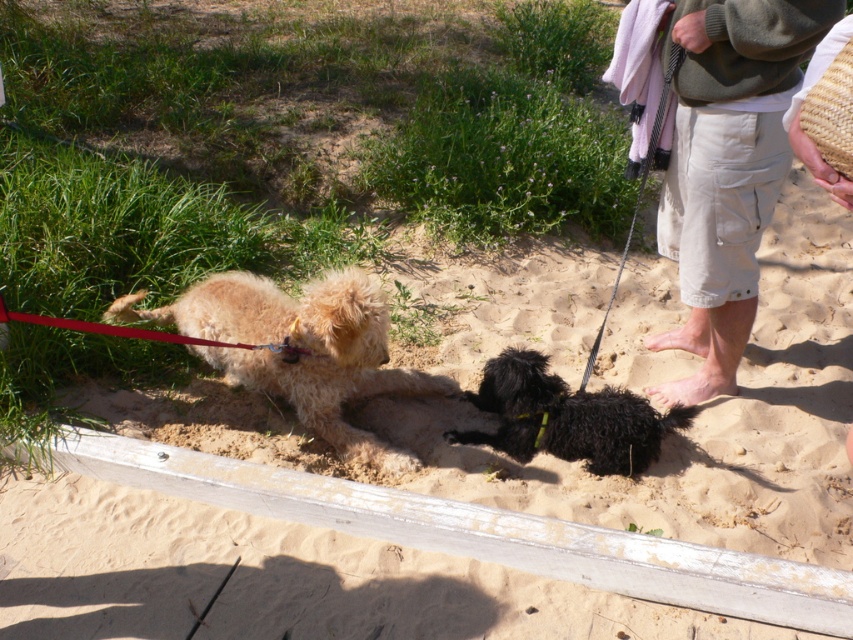
You are a dog owner who wants to ensure your black fuzzy dog at center stays cool on a hot day. Since the sandy yellow sand at center might get hot, can you determine from the image whether the sand is a safe spot for the dog to lie on based on their sizes?

The sandy yellow sand at center is larger in size than the black fuzzy dog at center, so the sand might not provide enough surface area to support the dog comfortably. However, the description does not mention temperature, so we cannot confirm if the sand is hot or safe for the dog.